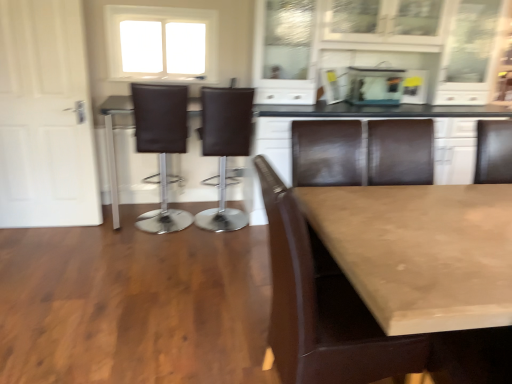
Question: Is transparent glass aquarium at upper center far from white matte door at left?

Choices:
 (A) no
 (B) yes

Answer: (B)

Question: From a real-world perspective, is transparent glass aquarium at upper center physically above white matte door at left?

Choices:
 (A) yes
 (B) no

Answer: (A)

Question: Is transparent glass aquarium at upper center not inside white matte door at left?

Choices:
 (A) yes
 (B) no

Answer: (A)

Question: From the image's perspective, is transparent glass aquarium at upper center above white matte door at left?

Choices:
 (A) yes
 (B) no

Answer: (A)

Question: Is transparent glass aquarium at upper center at the right side of white matte door at left?

Choices:
 (A) no
 (B) yes

Answer: (B)

Question: Is transparent glass aquarium at upper center to the left of white matte door at left from the viewer's perspective?

Choices:
 (A) yes
 (B) no

Answer: (B)

Question: Is white matte door at left at the left side of brown leather chair at center, the first chair positioned from the front?

Choices:
 (A) yes
 (B) no

Answer: (A)

Question: Does white matte door at left have a greater height compared to brown leather chair at center, which is the 3th chair in back-to-front order?

Choices:
 (A) yes
 (B) no

Answer: (A)

Question: Is the surface of white matte door at left in direct contact with brown leather chair at center, the first chair positioned from the front?

Choices:
 (A) no
 (B) yes

Answer: (A)

Question: From a real-world perspective, is white matte door at left located higher than brown leather chair at center, the third chair when ordered from left to right?

Choices:
 (A) yes
 (B) no

Answer: (A)

Question: Considering the relative positions of white matte door at left and brown leather chair at center, the first chair positioned from the front, in the image provided, is white matte door at left to the right of brown leather chair at center, the first chair positioned from the front, from the viewer's perspective?

Choices:
 (A) yes
 (B) no

Answer: (B)

Question: Is white matte door at left smaller than brown leather chair at center, the first chair positioned from the front?

Choices:
 (A) yes
 (B) no

Answer: (A)

Question: Is brown leather bar stool at center, marked as the first chair in a left-to-right arrangement, at the right side of brown leather chair at center, which is the 3th chair in back-to-front order?

Choices:
 (A) yes
 (B) no

Answer: (B)